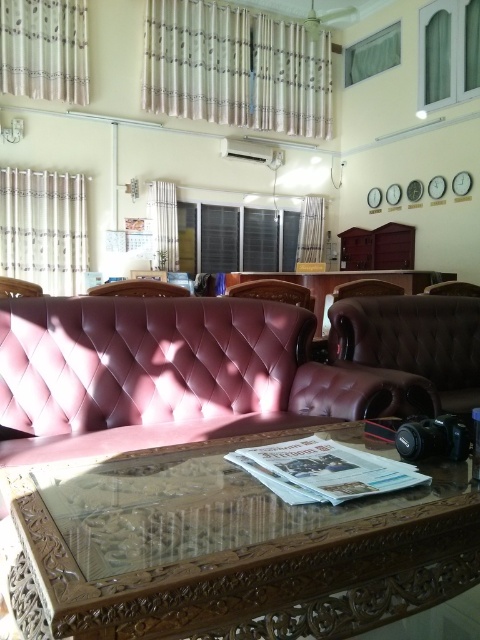
You are a guest in this lounge and want to sit down. Which object, the pink leather couch at center or the sheer fabric curtain at upper center, is more accessible for sitting?

The pink leather couch at center is more accessible for sitting because it is shorter than the sheer fabric curtain at upper center, making it easier to sit on.

From the picture: You are a delivery person who needs to place a large package that is 20 feet long in this room. The package must be placed between the transparent glass table at center and the white sheer curtain at upper left. Is there enough space between them to fit the package?

The transparent glass table at center and the white sheer curtain at upper left are 22.48 feet apart from each other. Since the package is 20 feet long, there is enough space between them to fit the package as the distance is greater than the package length.

You are a guest entering the room and see the pink leather couch at center and the sheer fabric curtain at upper center. Which object is closer to the ceiling?

The sheer fabric curtain at upper center is closer to the ceiling because it is positioned above the pink leather couch at center.